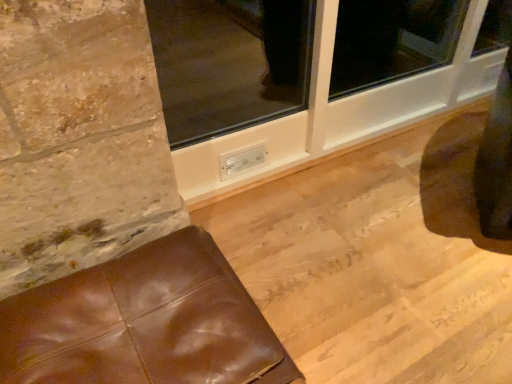
Question: Is point (281, 39) closer or farther from the camera than point (102, 274)?

Choices:
 (A) farther
 (B) closer

Answer: (A)

Question: From a real-world perspective, is white plastic window frame at lower center positioned above or below brown leather ottoman at lower left?

Choices:
 (A) above
 (B) below

Answer: (A)

Question: From the image's perspective, relative to brown leather ottoman at lower left, is white plastic window frame at lower center above or below?

Choices:
 (A) below
 (B) above

Answer: (B)

Question: Considering the positions of brown leather ottoman at lower left and white plastic window frame at lower center in the image, is brown leather ottoman at lower left bigger or smaller than white plastic window frame at lower center?

Choices:
 (A) big
 (B) small

Answer: (B)

Question: Is brown leather ottoman at lower left taller or shorter than white plastic window frame at lower center?

Choices:
 (A) short
 (B) tall

Answer: (A)

Question: Relative to white plastic window frame at lower center, is brown leather ottoman at lower left in front or behind?

Choices:
 (A) front
 (B) behind

Answer: (A)

Question: From a real-world perspective, relative to white plastic window frame at lower center, is brown leather ottoman at lower left vertically above or below?

Choices:
 (A) above
 (B) below

Answer: (B)